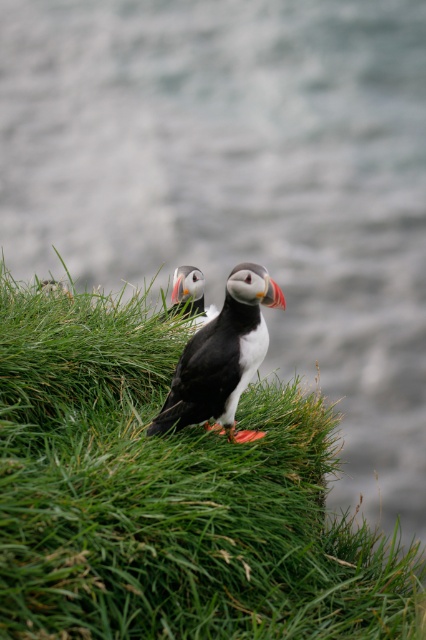
Question: Estimate the real-world distances between objects in this image. Which object is farther from the orange beak puffin at center?

Choices:
 (A) green grassy at center
 (B) black matte puffin at center

Answer: (B)

Question: Observing the image, what is the correct spatial positioning of green grassy at center in reference to black matte puffin at center?

Choices:
 (A) left
 (B) right

Answer: (A)

Question: Based on their relative distances, which object is farther from the orange beak puffin at center?

Choices:
 (A) black matte puffin at center
 (B) green grassy at center

Answer: (A)

Question: Is black matte puffin at center bigger than orange beak puffin at center?

Choices:
 (A) no
 (B) yes

Answer: (B)

Question: Observing the image, what is the correct spatial positioning of green grassy at center in reference to orange beak puffin at center?

Choices:
 (A) below
 (B) above

Answer: (A)

Question: Among these points, which one is nearest to the camera?

Choices:
 (A) (250, 349)
 (B) (198, 280)

Answer: (A)